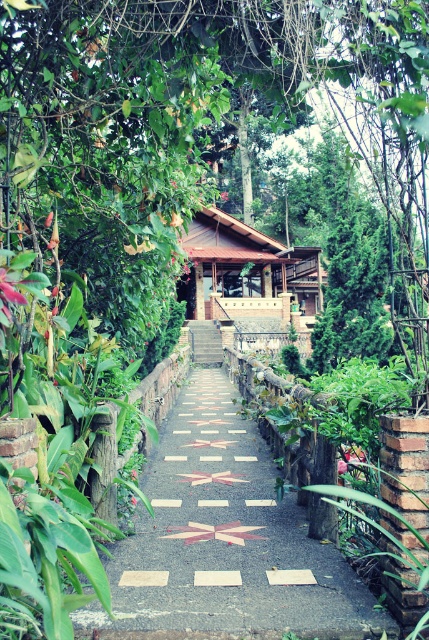
You are a visitor walking along the pathway and want to take a photo of both the green leafy tree at upper left and the brown wooden hut at center. Which object should you focus on first to ensure both are in the frame?

You should focus on the green leafy tree at upper left first because it is taller than the brown wooden hut at center, so positioning the camera to include its full height will naturally include the shorter hut in the frame as well.